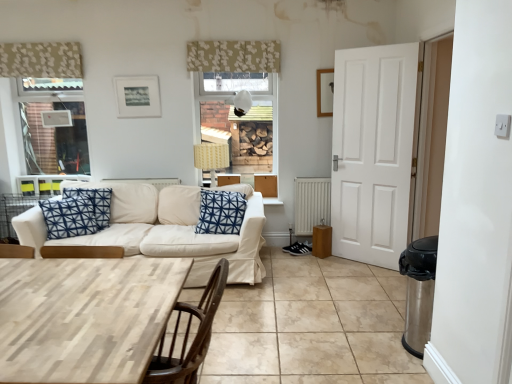
In order to click on free point above floral fabric curtain at upper center, which is the first curtain in right-to-left order (from a real-world perspective) in this screenshot , I will do `click(228, 40)`.